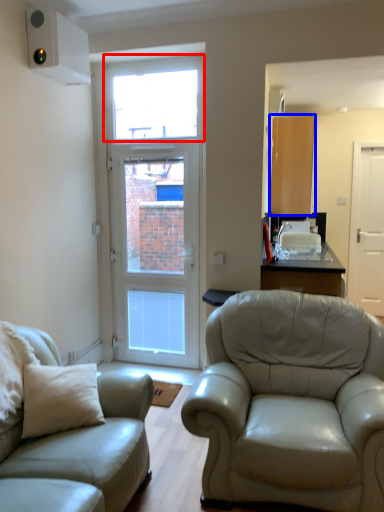
Question: Which object appears farthest to the camera in this image, window (highlighted by a red box) or cabinetry (highlighted by a blue box)?

Choices:
 (A) window
 (B) cabinetry

Answer: (B)